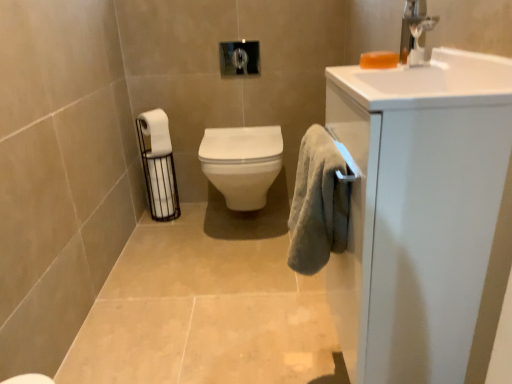
Question: Is white glossy cabinet at right taller than white matte toilet paper at left, arranged as the first toilet paper when ordered from the bottom?

Choices:
 (A) yes
 (B) no

Answer: (A)

Question: Considering the relative positions of white glossy cabinet at right and white matte toilet paper at left, the 2th toilet paper positioned from the top, in the image provided, is white glossy cabinet at right behind white matte toilet paper at left, the 2th toilet paper positioned from the top,?

Choices:
 (A) yes
 (B) no

Answer: (B)

Question: Is white glossy cabinet at right oriented towards white matte toilet paper at left, arranged as the first toilet paper when ordered from the bottom?

Choices:
 (A) yes
 (B) no

Answer: (B)

Question: From the image's perspective, would you say white glossy cabinet at right is positioned over white matte toilet paper at left, arranged as the first toilet paper when ordered from the bottom?

Choices:
 (A) yes
 (B) no

Answer: (B)

Question: Are white glossy cabinet at right and white matte toilet paper at left, the 2th toilet paper positioned from the top, making contact?

Choices:
 (A) no
 (B) yes

Answer: (A)

Question: Can you confirm if white glossy cabinet at right is smaller than white matte toilet paper at left, arranged as the first toilet paper when ordered from the bottom?

Choices:
 (A) yes
 (B) no

Answer: (B)

Question: Is white matte toilet paper at left, acting as the second toilet paper starting from the bottom, aimed at soft gray towel at right?

Choices:
 (A) no
 (B) yes

Answer: (B)

Question: Does white matte toilet paper at left, which is the 1th toilet paper in top-to-bottom order, come behind soft gray towel at right?

Choices:
 (A) no
 (B) yes

Answer: (B)

Question: Is white matte toilet paper at left, acting as the second toilet paper starting from the bottom, positioned before soft gray towel at right?

Choices:
 (A) yes
 (B) no

Answer: (B)

Question: Considering the relative positions of white matte toilet paper at left, which is the 1th toilet paper in top-to-bottom order, and soft gray towel at right in the image provided, is white matte toilet paper at left, which is the 1th toilet paper in top-to-bottom order, to the left of soft gray towel at right from the viewer's perspective?

Choices:
 (A) yes
 (B) no

Answer: (A)

Question: Is soft gray towel at right surrounded by white matte toilet paper at left, acting as the second toilet paper starting from the bottom?

Choices:
 (A) yes
 (B) no

Answer: (B)

Question: From a real-world perspective, is white matte toilet paper at left, which is the 1th toilet paper in top-to-bottom order, under soft gray towel at right?

Choices:
 (A) yes
 (B) no

Answer: (A)

Question: Does orange translucent soap at upper right have a smaller size compared to silver metallic faucet at upper right?

Choices:
 (A) yes
 (B) no

Answer: (A)